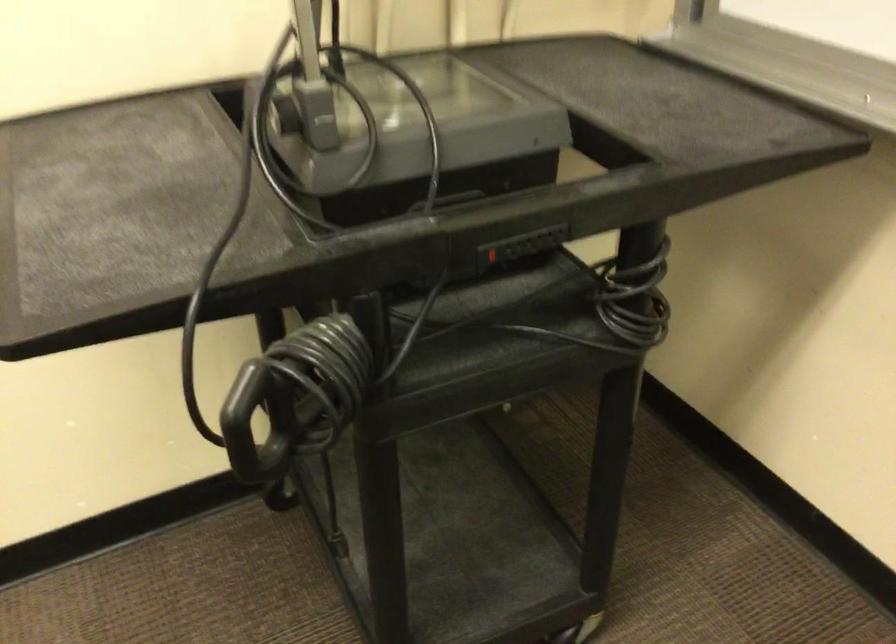
Find where to push the red power switch. Please return your answer as a coordinate pair (x, y).

(490, 254)